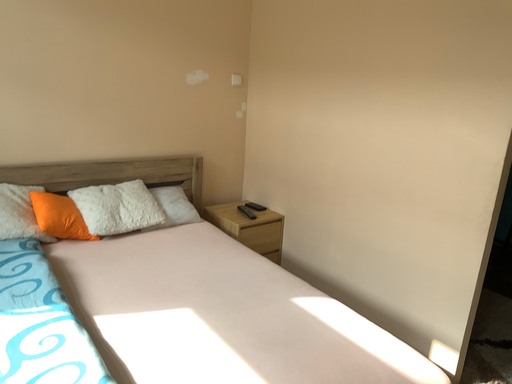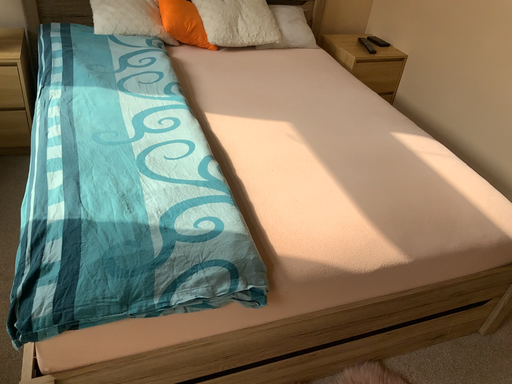
Question: How did the camera likely rotate when shooting the video?

Choices:
 (A) rotated right
 (B) rotated left

Answer: (B)